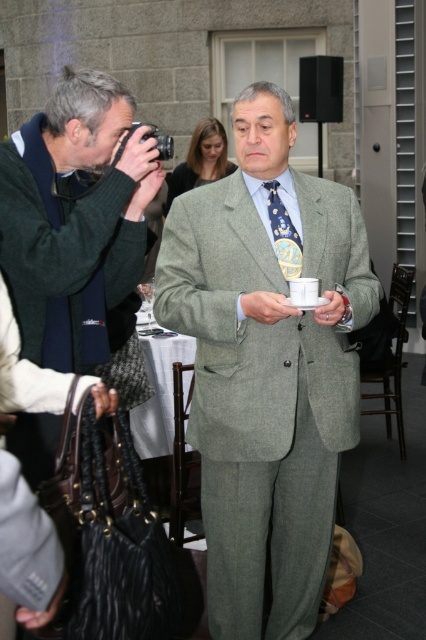
You are a photographer at the event and want to take a photo of the man in the green tweed suit holding a small white cup and saucer. The matte black camera at left is your only equipment. Can you use it to capture the man without moving the camera?

The matte black camera at left is 1.78 meters away from the man in the green tweed suit holding a small white cup and saucer. Since the camera can focus on subjects at that distance, yes, you can take the photo without moving the camera.

You are a photographer at the event and need to position the matte black camera at left and the blue dotted tie at center in a way that the camera doesn t block the view of the tie. Given their sizes, which object should be placed closer to the front?

The blue dotted tie at center should be placed closer to the front because the matte black camera at left is much taller and could obstruct the view of the shorter tie if placed in front.